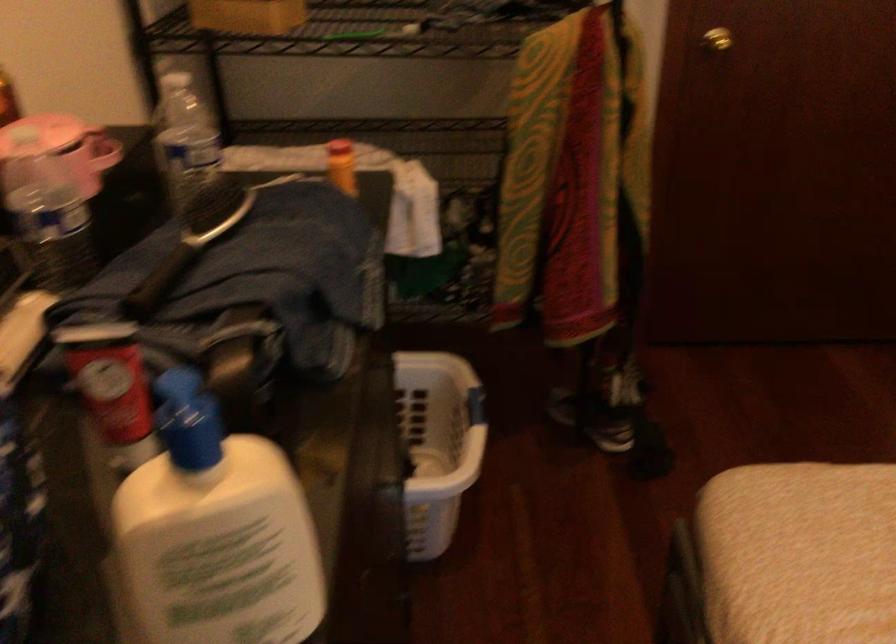
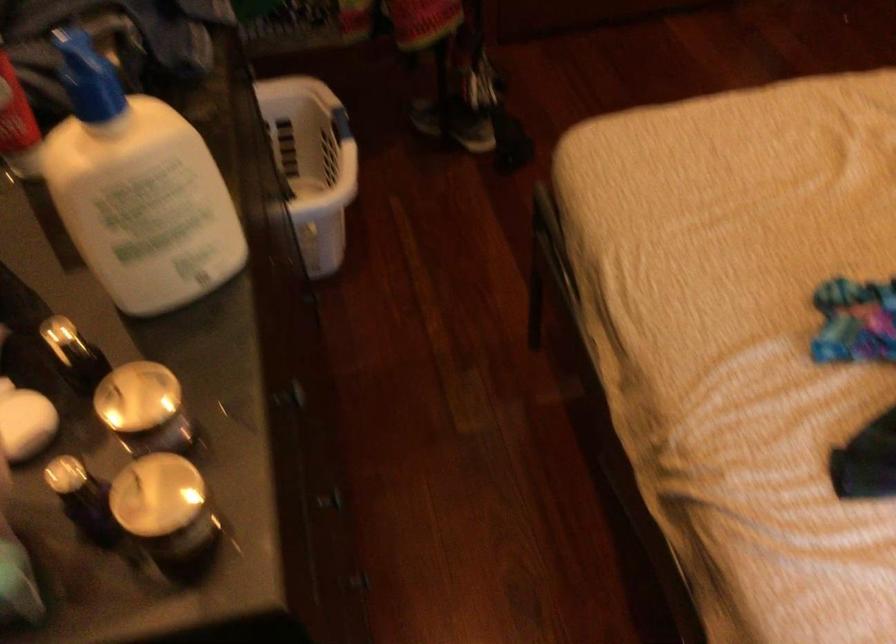
Question: Which direction would the cameraman need to move to produce the second image? Reply with the corresponding letter.

Choices:
 (A) Left
 (B) Right
 (C) Forward
 (D) Backward

Answer: (D)